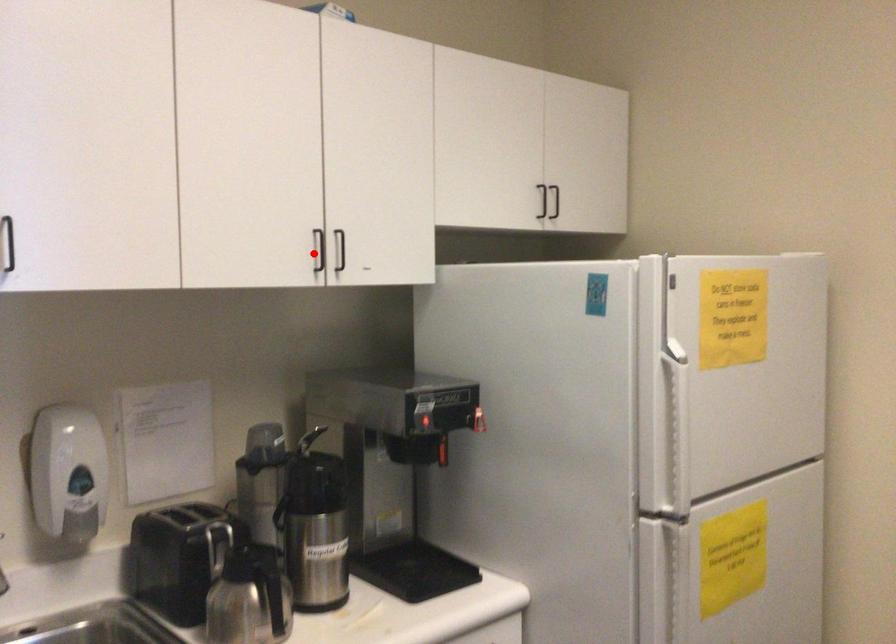
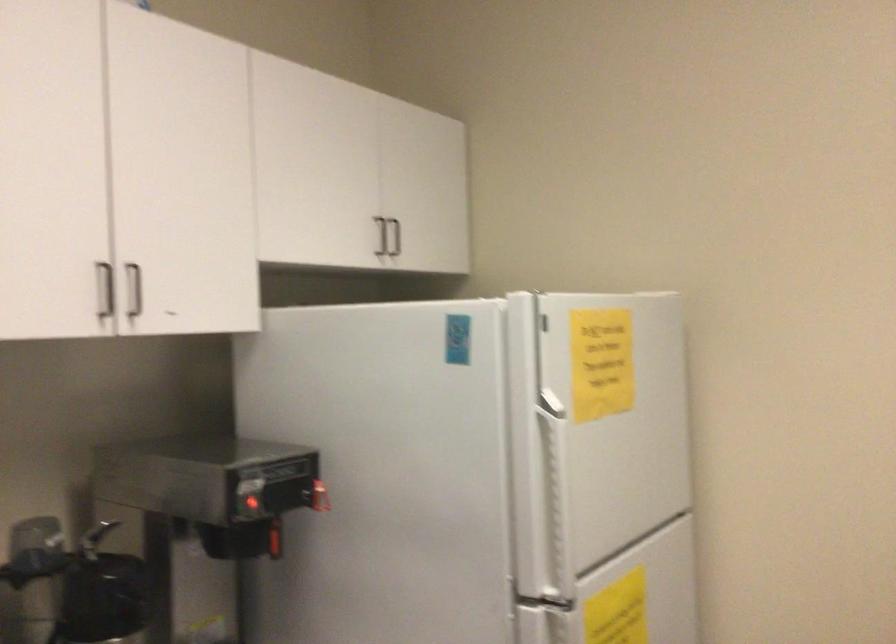
The point at the highlighted location is marked in the first image. Where is the corresponding point in the second image?

(105, 290)